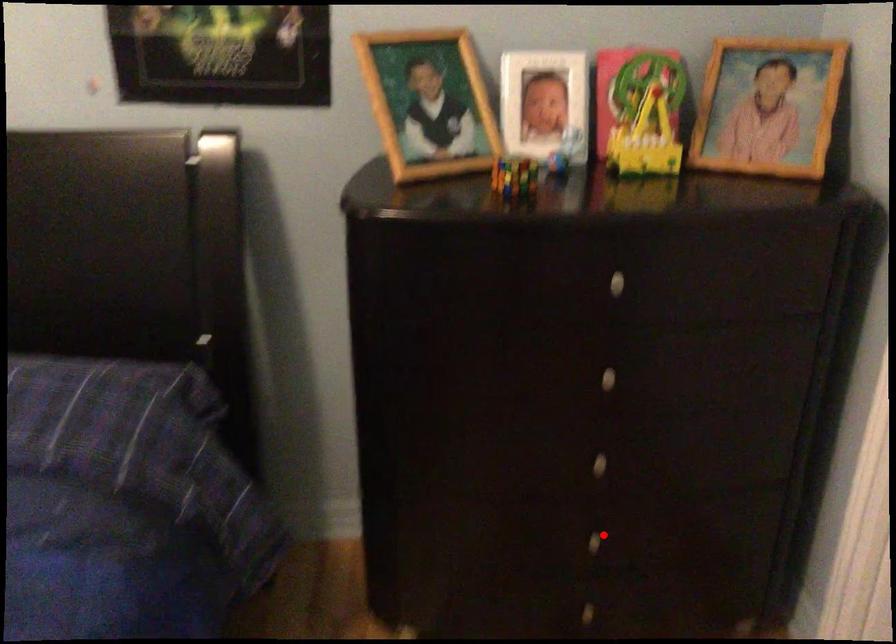
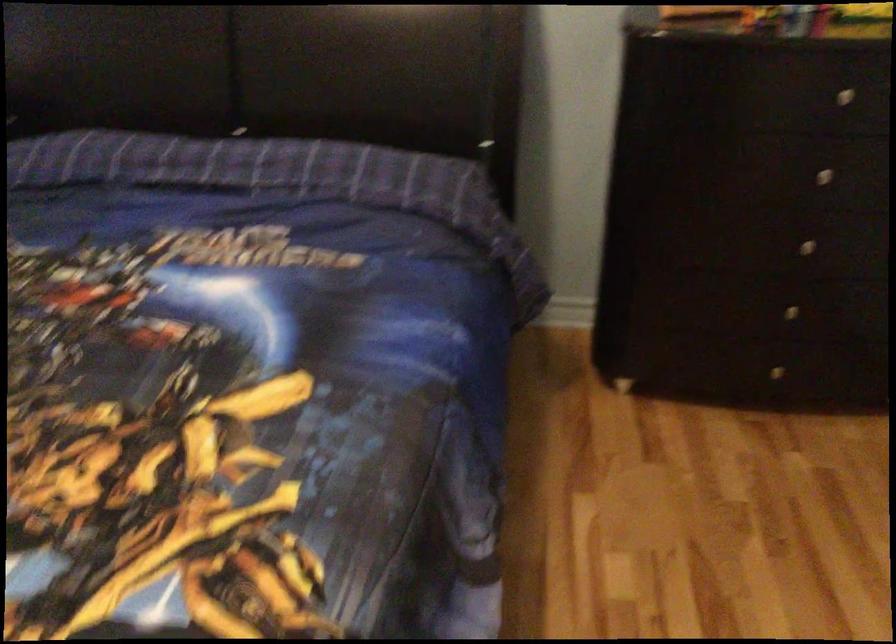
Where in the second image is the point corresponding to the highlighted location from the first image?

(790, 310)